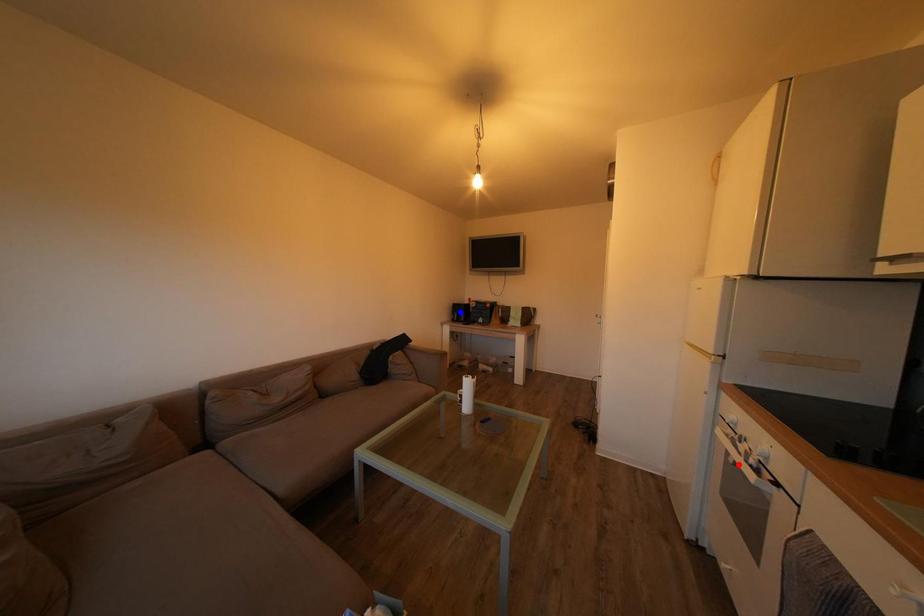
Question: Two points are marked on the image. Which point is closer to the camera?

Choices:
 (A) Blue point is closer.
 (B) Red point is closer.

Answer: (B)